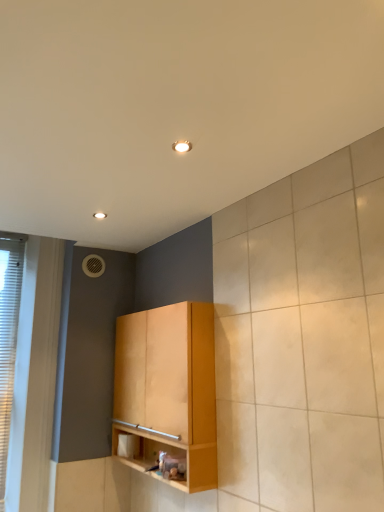
Question: From a real-world perspective, is light wood cabinet at center over white textured window at left?

Choices:
 (A) yes
 (B) no

Answer: (B)

Question: Is white textured window at left located within light wood cabinet at center?

Choices:
 (A) no
 (B) yes

Answer: (A)

Question: Can you confirm if light wood cabinet at center is shorter than white textured window at left?

Choices:
 (A) yes
 (B) no

Answer: (A)

Question: Considering the relative positions of light wood cabinet at center and white textured window at left in the image provided, is light wood cabinet at center behind white textured window at left?

Choices:
 (A) no
 (B) yes

Answer: (A)

Question: Does light wood cabinet at center have a smaller size compared to white textured window at left?

Choices:
 (A) yes
 (B) no

Answer: (B)

Question: Is light wood cabinet at center positioned far away from white textured window at left?

Choices:
 (A) no
 (B) yes

Answer: (A)

Question: Is white textured window at left outside light wood cabinet at center?

Choices:
 (A) no
 (B) yes

Answer: (B)

Question: From a real-world perspective, is white textured window at left under light wood cabinet at center?

Choices:
 (A) no
 (B) yes

Answer: (A)

Question: Is white textured window at left taller than light wood cabinet at center?

Choices:
 (A) no
 (B) yes

Answer: (B)

Question: Does white textured window at left have a greater width compared to light wood cabinet at center?

Choices:
 (A) no
 (B) yes

Answer: (A)

Question: Can you confirm if white textured window at left is shorter than light wood cabinet at center?

Choices:
 (A) no
 (B) yes

Answer: (A)

Question: Is the position of white textured window at left more distant than that of light wood cabinet at center?

Choices:
 (A) yes
 (B) no

Answer: (A)

Question: Is white textured window at left inside or outside of light wood cabinet at center?

Choices:
 (A) outside
 (B) inside

Answer: (A)